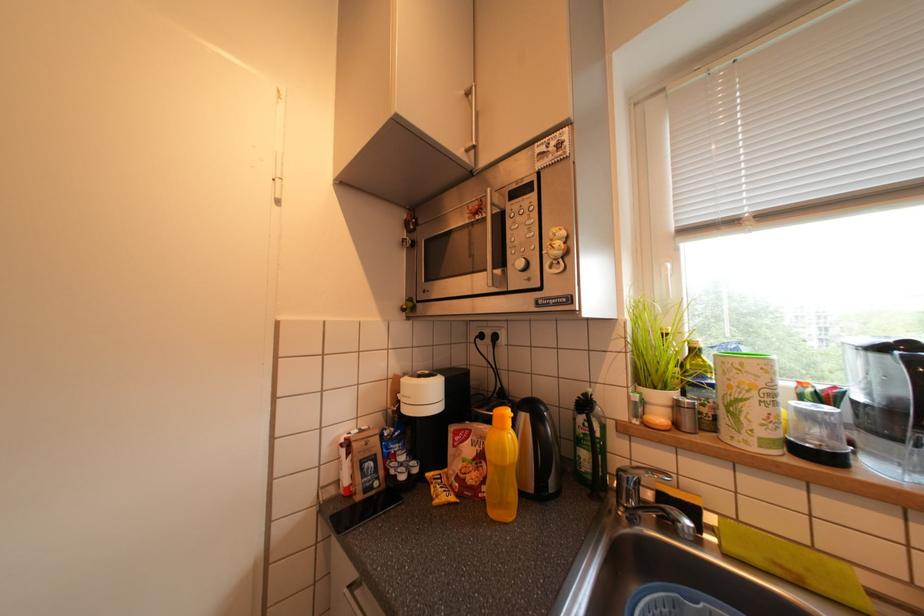
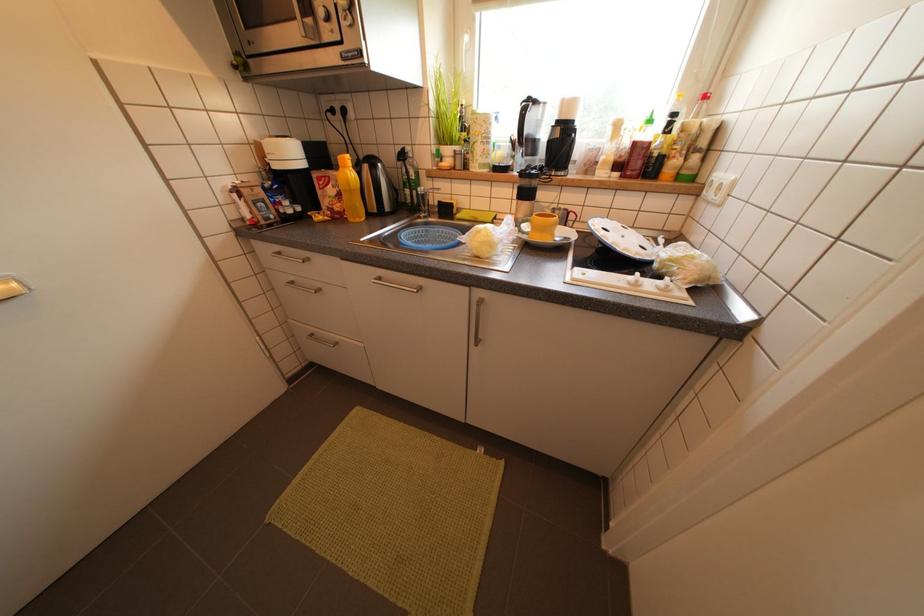
How did the camera likely rotate?

The rotation direction of the camera is right-down.